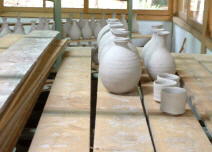
Identify the location of horizontal shelving. (81, 39).